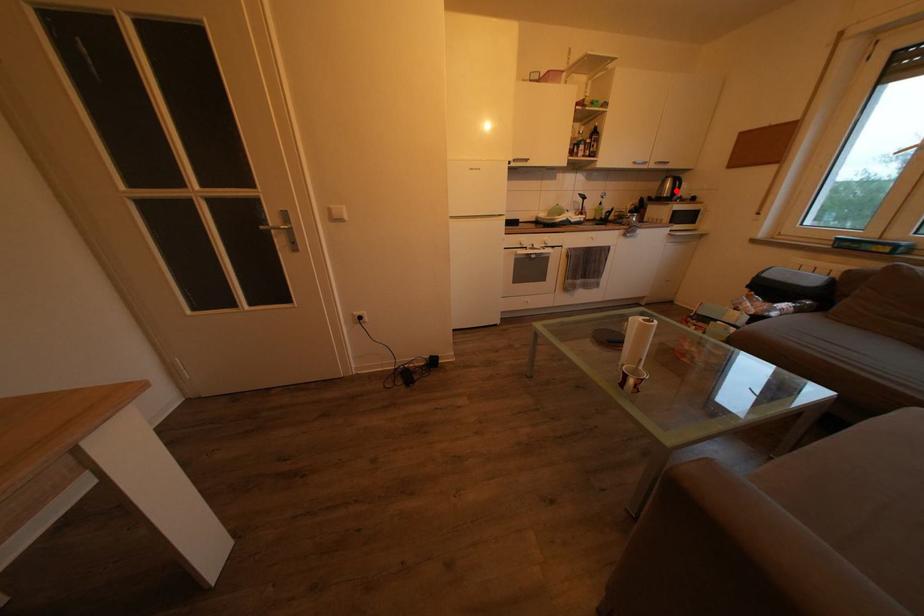
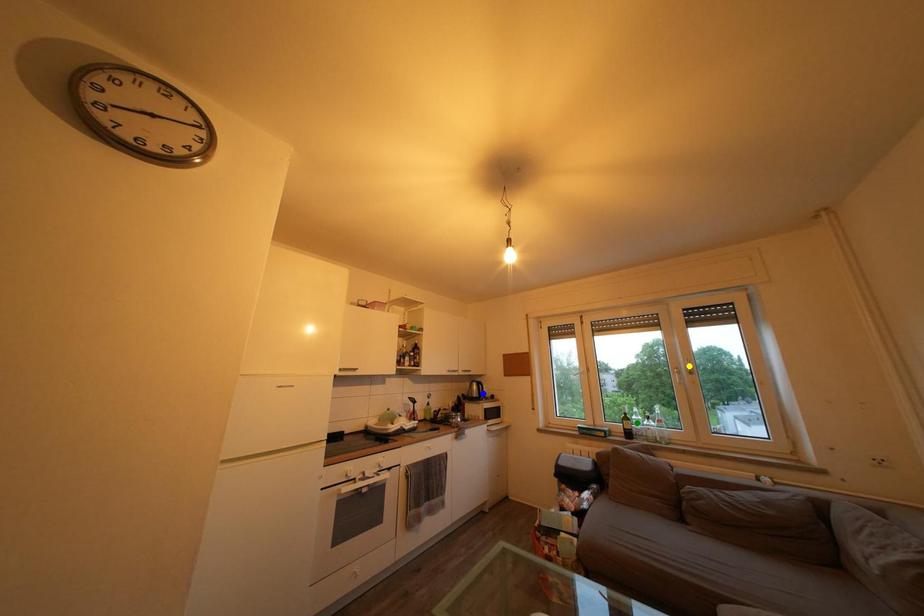
Question: I am providing you with two images of the same scene from different viewpoints. A red point is marked on the first image. You are given multiple points on the second image. Which spot in image 2 lines up with the point in image 1?

Choices:
 (A) blue point
 (B) yellow point
 (C) green point

Answer: (A)